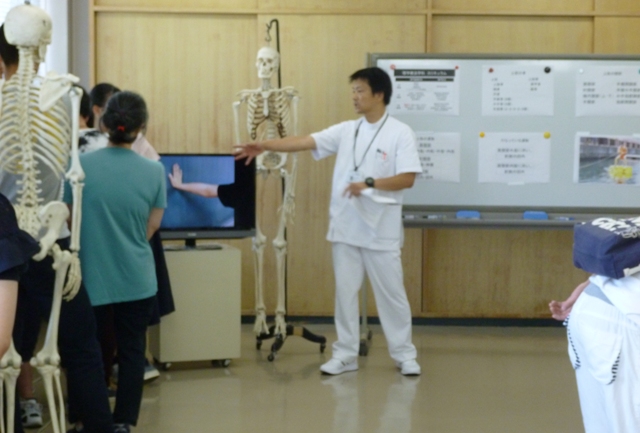
Where is `beige wall in background`? beige wall in background is located at coordinates (324, 39).